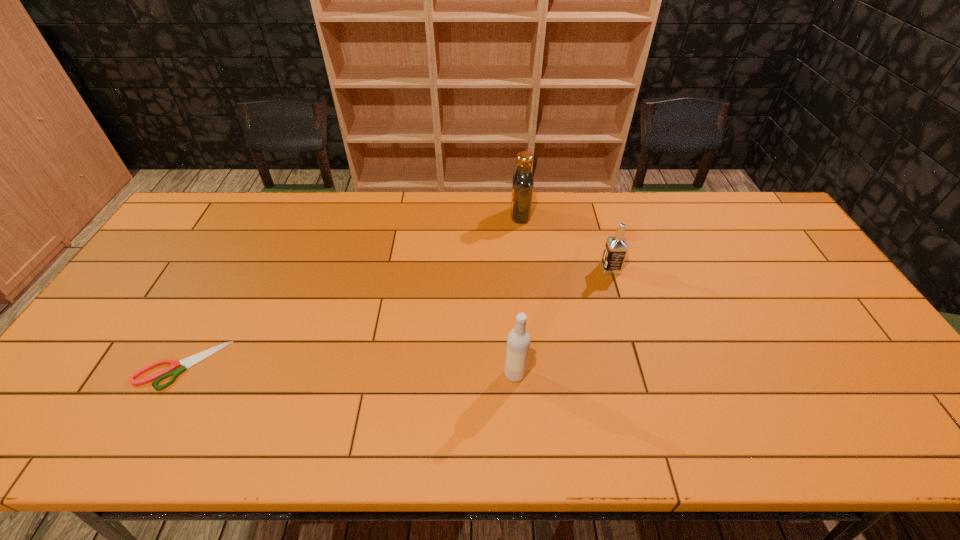
You are a GUI agent. You are given a task and a screenshot of the screen. Output one action in this format:
    pyautogui.click(x=<x>, y=<y>)
    Task: Click on the vacant area that lies between the nearest vodka and the shortest vodka
    
    Given the screenshot: What is the action you would take?
    pyautogui.click(x=563, y=321)

At what (x,y) coordinates should I click in order to perform the action: click on empty location between the rightmost vodka and the nearest vodka. Please return your answer as a coordinate pair (x, y). Looking at the image, I should click on (563, 321).

Locate an element on the screen. vacant area between the farthest object and the nearest vodka is located at coordinates (517, 294).

Identify the location of free spot between the nearest vodka and the farthest vodka. Image resolution: width=960 pixels, height=540 pixels. (517, 294).

The width and height of the screenshot is (960, 540). In order to click on free spot between the nearest vodka and the farthest vodka in this screenshot , I will do `click(517, 294)`.

You are a GUI agent. You are given a task and a screenshot of the screen. Output one action in this format:
    pyautogui.click(x=<x>, y=<y>)
    Task: Click on the vacant region between the nearest vodka and the farthest vodka
    
    Given the screenshot: What is the action you would take?
    pos(517,294)

Where is `blank region between the third nearest object and the farthest vodka`? The width and height of the screenshot is (960, 540). blank region between the third nearest object and the farthest vodka is located at coordinates (565, 241).

The height and width of the screenshot is (540, 960). Identify the location of empty space between the nearest vodka and the scissors. (348, 369).

Locate an element on the screen. This screenshot has height=540, width=960. free space between the rightmost vodka and the farthest object is located at coordinates (565, 241).

I want to click on object that is the nearest to the scissors, so click(518, 341).